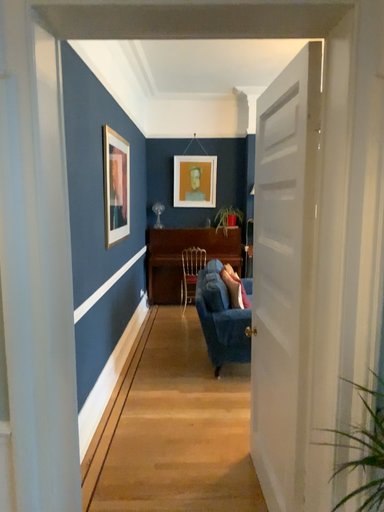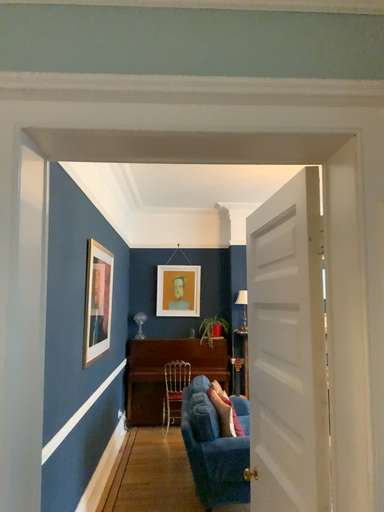
Question: How did the camera likely rotate when shooting the video?

Choices:
 (A) rotated upward
 (B) rotated downward

Answer: (A)